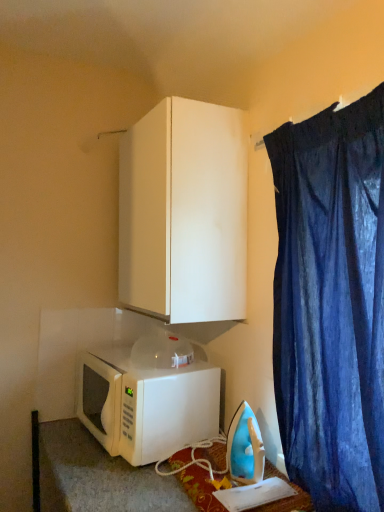
Question: Considering the relative sizes of white matte microwave at lower left and white matte cabinet at upper center in the image provided, is white matte microwave at lower left thinner than white matte cabinet at upper center?

Choices:
 (A) no
 (B) yes

Answer: (A)

Question: From the image's perspective, is white matte microwave at lower left located above white matte cabinet at upper center?

Choices:
 (A) yes
 (B) no

Answer: (B)

Question: From a real-world perspective, is white matte microwave at lower left positioned over white matte cabinet at upper center based on gravity?

Choices:
 (A) no
 (B) yes

Answer: (A)

Question: Is white matte microwave at lower left smaller than white matte cabinet at upper center?

Choices:
 (A) no
 (B) yes

Answer: (B)

Question: Is white matte microwave at lower left bigger than white matte cabinet at upper center?

Choices:
 (A) no
 (B) yes

Answer: (A)

Question: Does white matte microwave at lower left have a greater width compared to white matte cabinet at upper center?

Choices:
 (A) no
 (B) yes

Answer: (B)

Question: Is dark blue fabric at upper right far away from white matte microwave at lower left?

Choices:
 (A) no
 (B) yes

Answer: (A)

Question: Is dark blue fabric at upper right outside of white matte microwave at lower left?

Choices:
 (A) yes
 (B) no

Answer: (A)

Question: Can you confirm if dark blue fabric at upper right is shorter than white matte microwave at lower left?

Choices:
 (A) yes
 (B) no

Answer: (B)

Question: Can you confirm if dark blue fabric at upper right is positioned to the left of white matte microwave at lower left?

Choices:
 (A) no
 (B) yes

Answer: (A)

Question: Does dark blue fabric at upper right have a greater width compared to white matte microwave at lower left?

Choices:
 (A) no
 (B) yes

Answer: (A)

Question: Are dark blue fabric at upper right and white matte microwave at lower left making contact?

Choices:
 (A) no
 (B) yes

Answer: (A)

Question: From a real-world perspective, is white matte microwave at lower left located beneath blue plastic iron at lower right?

Choices:
 (A) no
 (B) yes

Answer: (A)